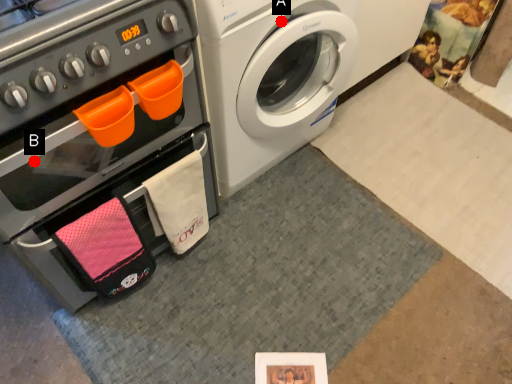
Question: Two points are circled on the image, labeled by A and B beside each circle. Which point is closer to the camera?

Choices:
 (A) A is closer
 (B) B is closer

Answer: (B)